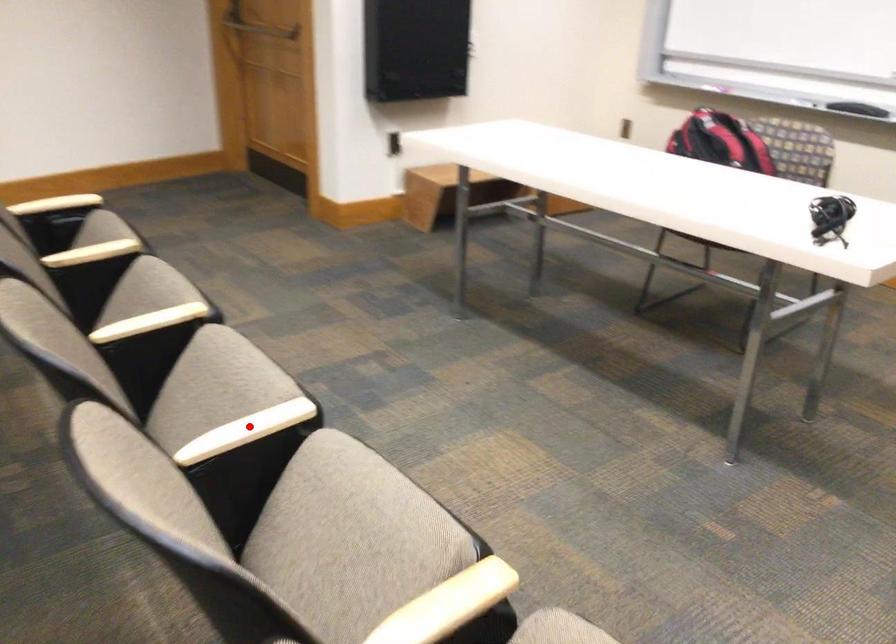
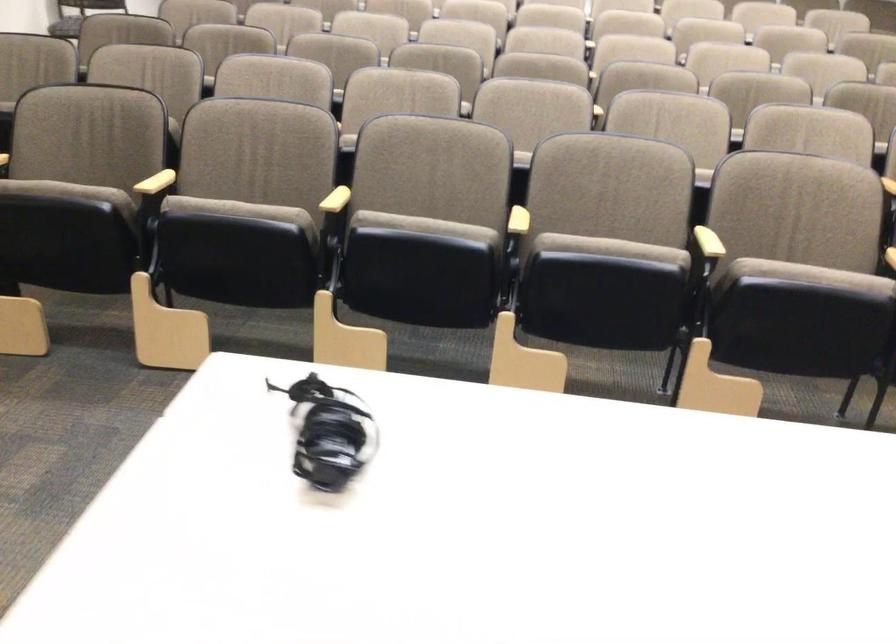
Question: A red point is marked in image1. In image2, is the corresponding 3D point closer to the camera or farther? Reply with the corresponding letter.

Choices:
 (A) The corresponding 3D point is closer.
 (B) The corresponding 3D point is farther.

Answer: (B)